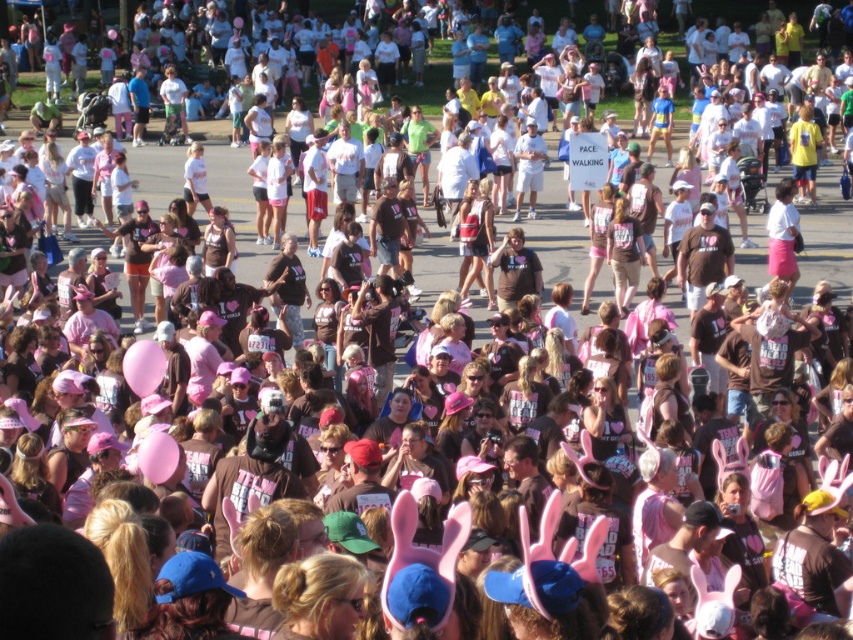
Question: Does pink rubber balloon at center appear on the right side of pink fabric balloon at center?

Choices:
 (A) yes
 (B) no

Answer: (B)

Question: Which object appears closest to the camera in this image?

Choices:
 (A) pink rubber balloon at center
 (B) pink fabric balloon at center

Answer: (B)

Question: Does pink rubber balloon at center have a greater width compared to pink fabric balloon at center?

Choices:
 (A) no
 (B) yes

Answer: (B)

Question: Observing the image, what is the correct spatial positioning of pink rubber balloon at center in reference to pink fabric balloon at center?

Choices:
 (A) below
 (B) above

Answer: (B)